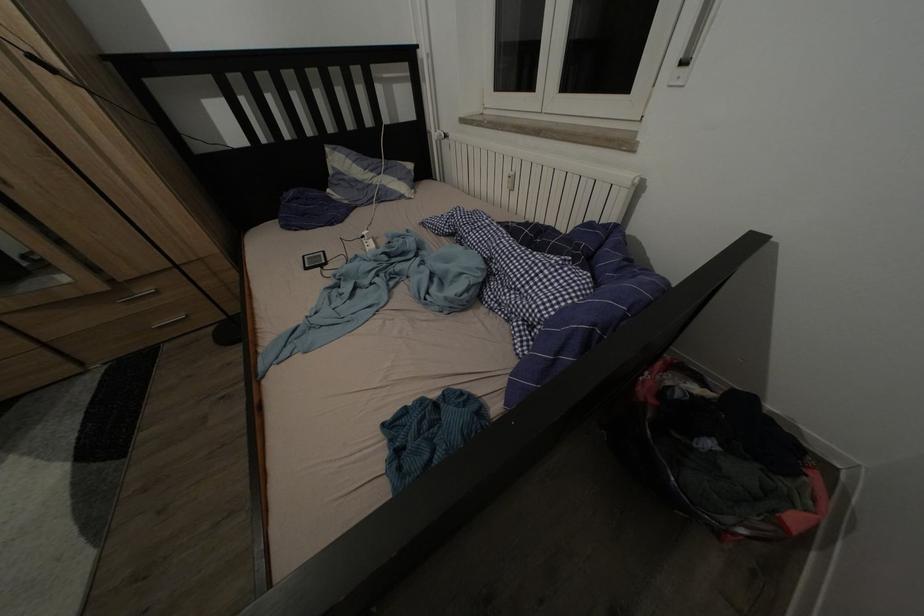
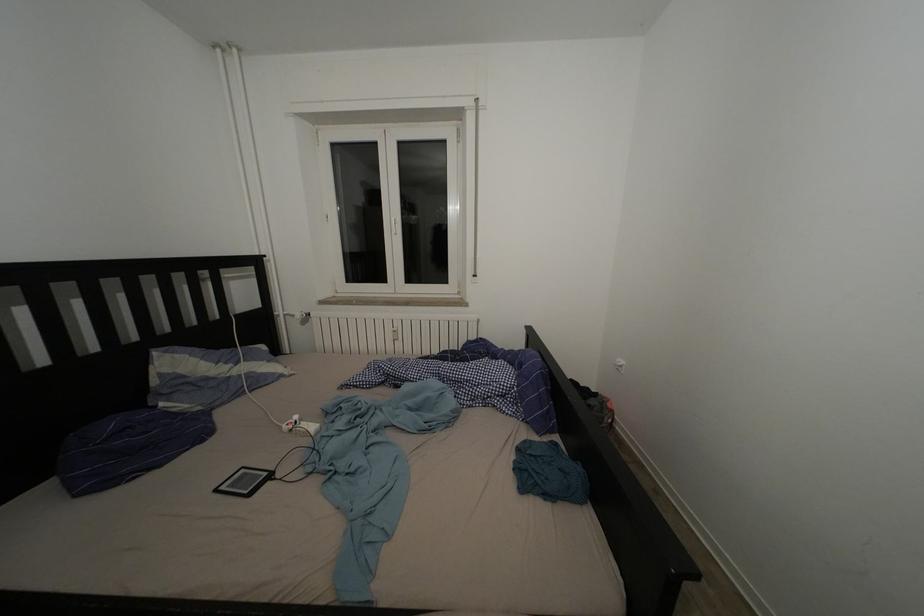
The images are taken continuously from a first-person perspective. In which direction is your viewpoint rotating?

The rotation direction of the camera is right-up.